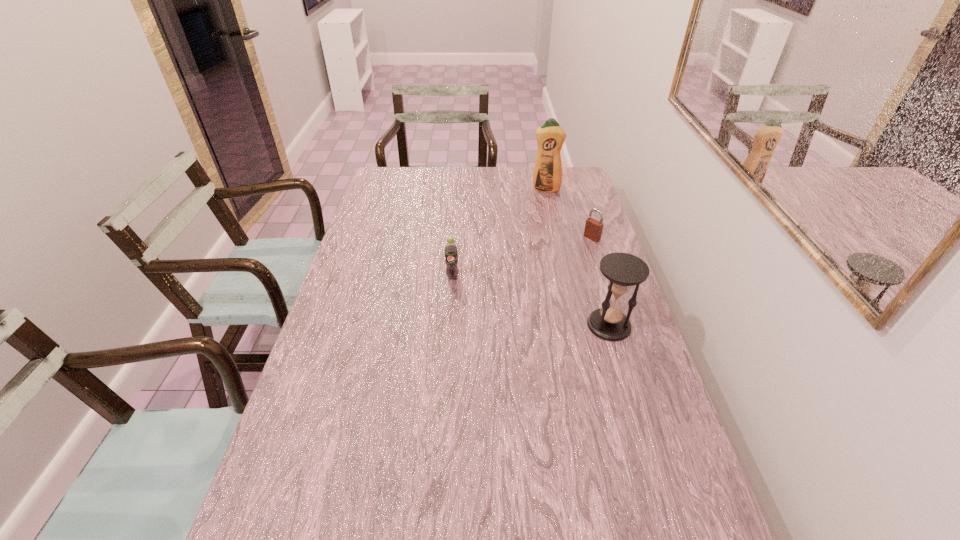
I want to click on vacant space located on the front-facing side of the padlock, so click(532, 279).

Identify the location of vacant area located on the front-facing side of the padlock. This screenshot has width=960, height=540. (575, 249).

What are the coordinates of `free point located on the front-facing side of the padlock` in the screenshot? It's located at (572, 252).

Identify the location of free space located 0.260m on the label of the detergent. The height and width of the screenshot is (540, 960). (536, 229).

Find the location of a particular element. The width and height of the screenshot is (960, 540). blank space located 0.140m on the label of the detergent is located at coordinates click(x=540, y=212).

Locate an element on the screen. The width and height of the screenshot is (960, 540). free location located on the label of the detergent is located at coordinates (536, 226).

Find the location of a particular element. object situated at the far edge is located at coordinates (547, 177).

At what (x,y) coordinates should I click in order to perform the action: click on hourglass located in the right edge section of the desktop. Please return your answer as a coordinate pair (x, y). Looking at the image, I should click on (622, 270).

The height and width of the screenshot is (540, 960). Identify the location of padlock that is at the right edge. tap(593, 229).

In order to click on detergent situated at the right edge in this screenshot , I will do `click(547, 177)`.